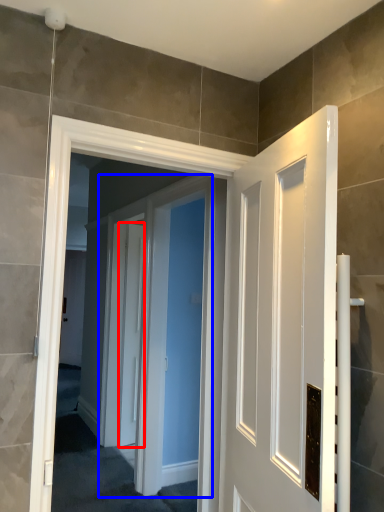
Question: Which object is further to the camera taking this photo, door (highlighted by a red box) or screen door (highlighted by a blue box)?

Choices:
 (A) door
 (B) screen door

Answer: (A)